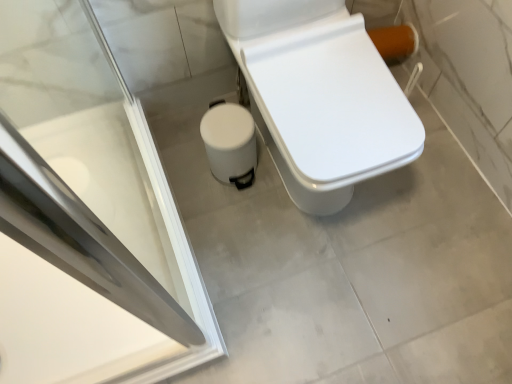
Question: Is white matte trash can at lower center far away from white glossy toilet at center?

Choices:
 (A) yes
 (B) no

Answer: (B)

Question: Is white matte trash can at lower center positioned behind white glossy toilet at center?

Choices:
 (A) yes
 (B) no

Answer: (A)

Question: Can you confirm if white matte trash can at lower center is smaller than white glossy toilet at center?

Choices:
 (A) yes
 (B) no

Answer: (A)

Question: Can you confirm if white matte trash can at lower center is positioned to the right of white glossy toilet at center?

Choices:
 (A) no
 (B) yes

Answer: (A)

Question: Is white glossy toilet at center at the back of white matte trash can at lower center?

Choices:
 (A) no
 (B) yes

Answer: (A)

Question: Is white matte trash can at lower center not inside white glossy toilet at center?

Choices:
 (A) yes
 (B) no

Answer: (A)

Question: Is transparent glass screen door at upper left in front of white glossy toilet at center?

Choices:
 (A) no
 (B) yes

Answer: (B)

Question: From the image's perspective, is transparent glass screen door at upper left on top of white glossy toilet at center?

Choices:
 (A) no
 (B) yes

Answer: (A)

Question: Is transparent glass screen door at upper left bigger than white glossy toilet at center?

Choices:
 (A) no
 (B) yes

Answer: (A)

Question: Is transparent glass screen door at upper left surrounding white glossy toilet at center?

Choices:
 (A) yes
 (B) no

Answer: (B)

Question: Does transparent glass screen door at upper left have a greater width compared to white glossy toilet at center?

Choices:
 (A) no
 (B) yes

Answer: (B)

Question: Considering the relative sizes of transparent glass screen door at upper left and white glossy toilet at center in the image provided, is transparent glass screen door at upper left thinner than white glossy toilet at center?

Choices:
 (A) no
 (B) yes

Answer: (A)

Question: Is white glossy toilet at center not close to white matte trash can at lower center?

Choices:
 (A) yes
 (B) no

Answer: (B)